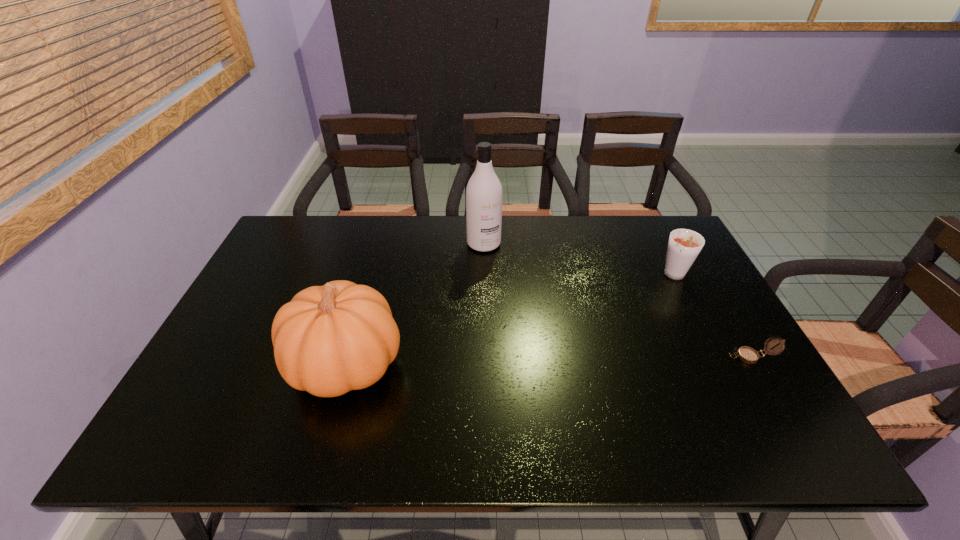
Identify the location of root beer that is at the right edge. The width and height of the screenshot is (960, 540). coord(684,245).

In the image, there is a desktop. At what (x,y) coordinates should I click in order to perform the action: click on blank space at the far edge. Please return your answer as a coordinate pair (x, y). This screenshot has width=960, height=540. Looking at the image, I should click on (564, 249).

This screenshot has height=540, width=960. What are the coordinates of `blank space at the near edge` in the screenshot? It's located at (584, 379).

This screenshot has width=960, height=540. I want to click on vacant space at the left edge, so click(x=221, y=373).

In the image, there is a desktop. At what (x,y) coordinates should I click in order to perform the action: click on free space at the right edge. Please return your answer as a coordinate pair (x, y). Looking at the image, I should click on [x=684, y=320].

This screenshot has height=540, width=960. What are the coordinates of `free space at the near right corner` in the screenshot? It's located at (746, 392).

At what (x,y) coordinates should I click in order to perform the action: click on free spot between the pumpkin and the third nearest object. Please return your answer as a coordinate pair (x, y). This screenshot has width=960, height=540. Looking at the image, I should click on (511, 320).

You are a GUI agent. You are given a task and a screenshot of the screen. Output one action in this format:
    pyautogui.click(x=<x>, y=<y>)
    Task: Click on the empty space between the second shortest object and the leftmost object
    The width and height of the screenshot is (960, 540).
    Given the screenshot: What is the action you would take?
    pyautogui.click(x=511, y=320)

What are the coordinates of `free space between the tallest object and the shortest object` in the screenshot? It's located at (617, 300).

Where is `free space between the second farthest object and the third shortest object`? The height and width of the screenshot is (540, 960). free space between the second farthest object and the third shortest object is located at coordinates (511, 320).